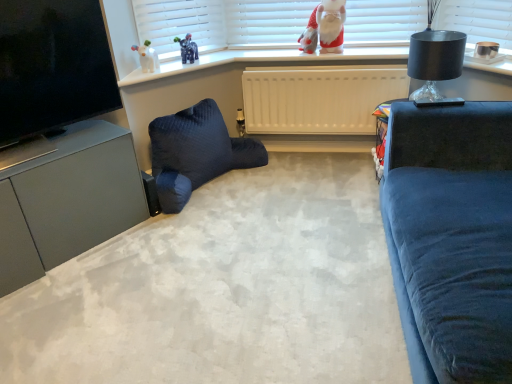
Question: Considering the relative sizes of matte black tv at left and satin grey cabinet at lower left in the image provided, is matte black tv at left smaller than satin grey cabinet at lower left?

Choices:
 (A) no
 (B) yes

Answer: (B)

Question: Is matte black tv at left outside of satin grey cabinet at lower left?

Choices:
 (A) yes
 (B) no

Answer: (A)

Question: From a real-world perspective, is matte black tv at left positioned under satin grey cabinet at lower left based on gravity?

Choices:
 (A) yes
 (B) no

Answer: (B)

Question: Is matte black tv at left at the right side of satin grey cabinet at lower left?

Choices:
 (A) yes
 (B) no

Answer: (A)

Question: Is there a large distance between matte black tv at left and satin grey cabinet at lower left?

Choices:
 (A) yes
 (B) no

Answer: (B)

Question: Is point (35, 195) closer or farther from the camera than point (360, 56)?

Choices:
 (A) closer
 (B) farther

Answer: (A)

Question: Is satin grey cabinet at lower left wider or thinner than white glossy window sill at upper center?

Choices:
 (A) thin
 (B) wide

Answer: (A)

Question: From the image's perspective, relative to white glossy window sill at upper center, is satin grey cabinet at lower left above or below?

Choices:
 (A) below
 (B) above

Answer: (A)

Question: Visually, is satin grey cabinet at lower left positioned to the left or to the right of white glossy window sill at upper center?

Choices:
 (A) left
 (B) right

Answer: (A)

Question: Based on their sizes in the image, would you say dark blue quilted bean bag chair at lower left is bigger or smaller than red plush santa at upper center?

Choices:
 (A) big
 (B) small

Answer: (A)

Question: Considering the positions of dark blue quilted bean bag chair at lower left and red plush santa at upper center in the image, is dark blue quilted bean bag chair at lower left wider or thinner than red plush santa at upper center?

Choices:
 (A) thin
 (B) wide

Answer: (B)

Question: From a real-world perspective, relative to red plush santa at upper center, is dark blue quilted bean bag chair at lower left vertically above or below?

Choices:
 (A) below
 (B) above

Answer: (A)

Question: Is dark blue quilted bean bag chair at lower left in front of or behind red plush santa at upper center in the image?

Choices:
 (A) behind
 (B) front

Answer: (B)

Question: Is white glossy window sill at upper center situated inside white glossy elephant at upper left or outside?

Choices:
 (A) outside
 (B) inside

Answer: (A)

Question: Based on their sizes in the image, would you say white glossy window sill at upper center is bigger or smaller than white glossy elephant at upper left?

Choices:
 (A) big
 (B) small

Answer: (A)